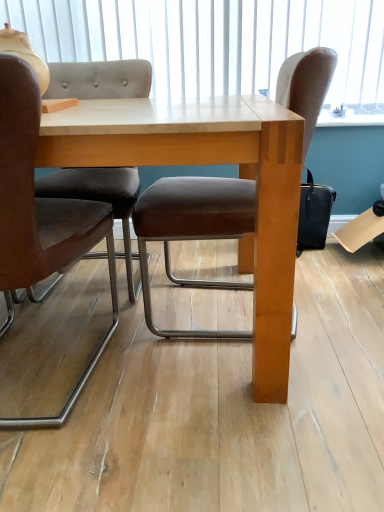
Question: Considering the relative sizes of white matte window screen at upper center and brown leather chair at left, positioned as the second chair in right-to-left order, in the image provided, is white matte window screen at upper center shorter than brown leather chair at left, positioned as the second chair in right-to-left order,?

Choices:
 (A) no
 (B) yes

Answer: (B)

Question: Are white matte window screen at upper center and brown leather chair at left, positioned as the second chair in right-to-left order, far apart?

Choices:
 (A) no
 (B) yes

Answer: (B)

Question: Is white matte window screen at upper center positioned with its back to brown leather chair at left, positioned as the second chair in right-to-left order?

Choices:
 (A) yes
 (B) no

Answer: (B)

Question: Does white matte window screen at upper center have a greater width compared to brown leather chair at left, arranged as the first chair when viewed from the left?

Choices:
 (A) yes
 (B) no

Answer: (B)

Question: Is white matte window screen at upper center to the left of brown leather chair at left, positioned as the second chair in right-to-left order, from the viewer's perspective?

Choices:
 (A) yes
 (B) no

Answer: (B)

Question: From a real-world perspective, is white matte window screen at upper center positioned above or below brown leather chair at center, which is the 2th chair in left-to-right order?

Choices:
 (A) above
 (B) below

Answer: (A)

Question: Do you think white matte window screen at upper center is within brown leather chair at center, which is the 1th chair in right-to-left order, or outside of it?

Choices:
 (A) inside
 (B) outside

Answer: (B)

Question: From the image's perspective, is white matte window screen at upper center above or below brown leather chair at center, which is the 1th chair in right-to-left order?

Choices:
 (A) above
 (B) below

Answer: (A)

Question: In terms of size, does white matte window screen at upper center appear bigger or smaller than brown leather chair at center, which is the 1th chair in right-to-left order?

Choices:
 (A) small
 (B) big

Answer: (A)

Question: Is brown leather chair at center, which is the 2th chair in left-to-right order, in front of or behind white matte window screen at upper center in the image?

Choices:
 (A) front
 (B) behind

Answer: (A)

Question: Is brown leather chair at center, which is the 1th chair in right-to-left order, to the left or to the right of white matte window screen at upper center in the image?

Choices:
 (A) left
 (B) right

Answer: (B)

Question: Do you think brown leather chair at center, which is the 1th chair in right-to-left order, is within white matte window screen at upper center, or outside of it?

Choices:
 (A) inside
 (B) outside

Answer: (B)

Question: From their relative heights in the image, would you say brown leather chair at center, which is the 1th chair in right-to-left order, is taller or shorter than white matte window screen at upper center?

Choices:
 (A) tall
 (B) short

Answer: (A)

Question: Would you say brown leather chair at left, positioned as the second chair in right-to-left order, is inside or outside white matte window screen at upper center?

Choices:
 (A) outside
 (B) inside

Answer: (A)

Question: Considering the positions of point (34, 254) and point (365, 42), is point (34, 254) closer or farther from the camera than point (365, 42)?

Choices:
 (A) closer
 (B) farther

Answer: (A)